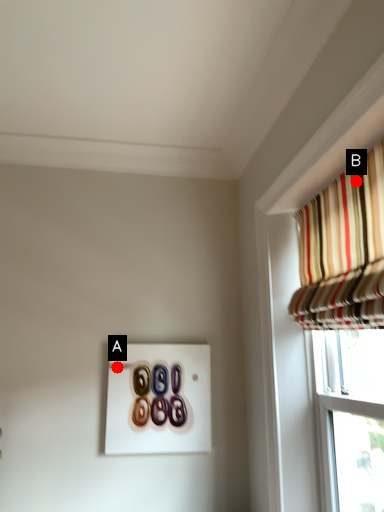
Question: Two points are circled on the image, labeled by A and B beside each circle. Among these points, which one is farthest from the camera?

Choices:
 (A) A is further
 (B) B is further

Answer: (A)